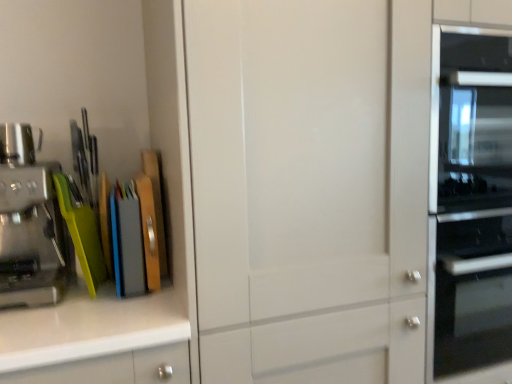
Image resolution: width=512 pixels, height=384 pixels. What do you see at coordinates (16, 144) in the screenshot? I see `brushed metal coffee maker at left` at bounding box center [16, 144].

What do you see at coordinates (310, 188) in the screenshot? I see `transparent glass cabinet at center` at bounding box center [310, 188].

Locate an element on the screen. Image resolution: width=512 pixels, height=384 pixels. brushed metal coffee maker at left is located at coordinates (16, 144).

In the scene shown: Can you confirm if transparent glass cabinet at center is smaller than brushed metal coffee machine at left?

No, transparent glass cabinet at center is not smaller than brushed metal coffee machine at left.

Relative to brushed metal coffee machine at left, is transparent glass cabinet at center in front or behind?

transparent glass cabinet at center is positioned closer to the viewer than brushed metal coffee machine at left.

Is transparent glass cabinet at center thinner than brushed metal coffee machine at left?

No.

From a real-world perspective, is transparent glass cabinet at center over brushed metal coffee machine at left?

No, from a real-world perspective, transparent glass cabinet at center is not over brushed metal coffee machine at left

From the image's perspective, between transparent glass cabinet at center and brushed metal coffee maker at left, which one is located above?

From the image's view, brushed metal coffee maker at left is above.

Is transparent glass cabinet at center not inside brushed metal coffee maker at left?

Yes, transparent glass cabinet at center is not within brushed metal coffee maker at left.

From a real-world perspective, between transparent glass cabinet at center and brushed metal coffee maker at left, who is vertically higher?

From a 3D spatial view, brushed metal coffee maker at left is above.

Is brushed metal coffee maker at left placed right next to transparent glass cabinet at center?

No, brushed metal coffee maker at left is not touching transparent glass cabinet at center.

Can you confirm if brushed metal coffee maker at left is bigger than transparent glass cabinet at center?

No.

This screenshot has height=384, width=512. What are the coordinates of `appliance above the transparent glass cabinet at center (from the image's perspective)` in the screenshot? It's located at (16, 144).

Considering the sizes of objects brushed metal coffee maker at left and transparent glass cabinet at center in the image provided, who is wider, brushed metal coffee maker at left or transparent glass cabinet at center?

transparent glass cabinet at center is wider.

Does brushed metal coffee maker at left lie in front of brushed metal coffee machine at left?

No, brushed metal coffee maker at left is further to the viewer.

Does brushed metal coffee maker at left have a larger size compared to brushed metal coffee machine at left?

Actually, brushed metal coffee maker at left might be smaller than brushed metal coffee machine at left.

From the picture: From a real-world perspective, which is physically above, brushed metal coffee maker at left or brushed metal coffee machine at left?

In real-world perspective, brushed metal coffee maker at left is above.

Choose the correct answer: Is brushed metal coffee maker at left inside brushed metal coffee machine at left or outside it?

brushed metal coffee maker at left lies outside brushed metal coffee machine at left.

Does brushed metal coffee machine at left appear on the right side of transparent glass cabinet at center?

In fact, brushed metal coffee machine at left is to the left of transparent glass cabinet at center.

Is brushed metal coffee machine at left touching transparent glass cabinet at center?

No, brushed metal coffee machine at left is not making contact with transparent glass cabinet at center.

How far apart are brushed metal coffee machine at left and transparent glass cabinet at center?

brushed metal coffee machine at left is 22.99 inches from transparent glass cabinet at center.

Considering the points (11, 170) and (334, 167), which point is in front, point (11, 170) or point (334, 167)?

Point (11, 170)

Who is taller, brushed metal coffee machine at left or brushed metal coffee maker at left?

With more height is brushed metal coffee machine at left.

Does brushed metal coffee machine at left appear on the right side of brushed metal coffee maker at left?

No.

Relative to brushed metal coffee maker at left, is brushed metal coffee machine at left in front or behind?

In the image, brushed metal coffee machine at left appears in front of brushed metal coffee maker at left.

Is brushed metal coffee maker at left inside brushed metal coffee machine at left?

No, brushed metal coffee maker at left is not surrounded by brushed metal coffee machine at left.

The image size is (512, 384). I want to click on kitchen appliance above the transparent glass cabinet at center (from a real-world perspective), so click(x=30, y=236).

This screenshot has width=512, height=384. Identify the location of glass door located below the brushed metal coffee maker at left (from the image's perspective). (310, 188).

Based on the photo, from the image, which object appears to be nearer to brushed metal coffee machine at left, brushed metal coffee maker at left or transparent glass cabinet at center?

brushed metal coffee maker at left is closer to brushed metal coffee machine at left.

Looking at the image, which one is located further to transparent glass cabinet at center, brushed metal coffee machine at left or brushed metal coffee maker at left?

Among the two, brushed metal coffee maker at left is located further to transparent glass cabinet at center.

From the image, which object appears to be nearer to brushed metal coffee machine at left, transparent glass cabinet at center or brushed metal coffee maker at left?

brushed metal coffee maker at left lies closer to brushed metal coffee machine at left than the other object.

Looking at the image, which one is located further to brushed metal coffee maker at left, transparent glass cabinet at center or brushed metal coffee machine at left?

transparent glass cabinet at center lies further to brushed metal coffee maker at left than the other object.

Considering their positions, is brushed metal coffee maker at left positioned closer to transparent glass cabinet at center than brushed metal coffee machine at left?

Among the two, brushed metal coffee machine at left is located nearer to transparent glass cabinet at center.

Looking at the image, which one is located further to brushed metal coffee maker at left, brushed metal coffee machine at left or transparent glass cabinet at center?

transparent glass cabinet at center lies further to brushed metal coffee maker at left than the other object.

At what (x,y) coordinates should I click in order to perform the action: click on appliance between brushed metal coffee machine at left and transparent glass cabinet at center from left to right. Please return your answer as a coordinate pair (x, y). This screenshot has width=512, height=384. Looking at the image, I should click on (16, 144).